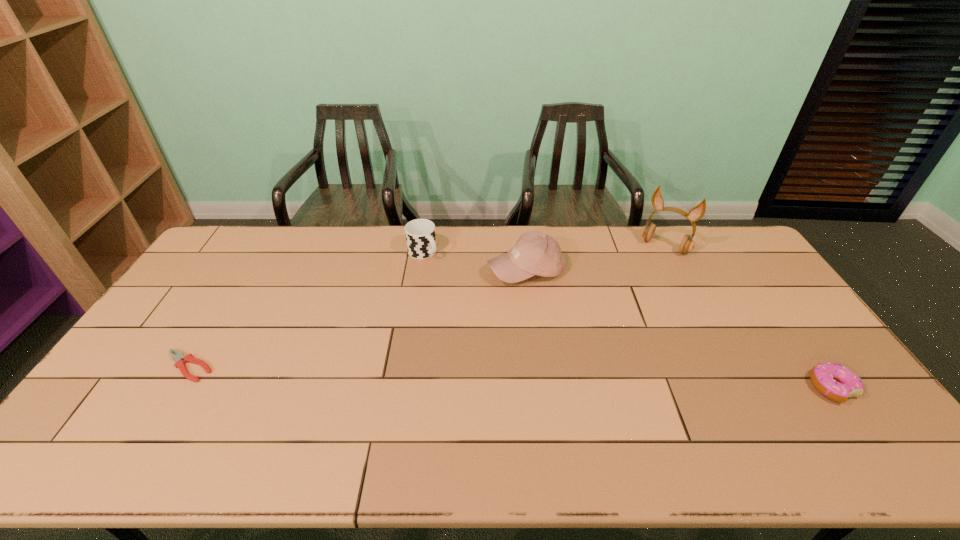
Locate an element on the screen. The height and width of the screenshot is (540, 960). vacant area that lies between the fourth shortest object and the fourth tallest object is located at coordinates (679, 329).

Locate an element on the screen. The width and height of the screenshot is (960, 540). free space between the leftmost object and the rightmost object is located at coordinates (510, 377).

Choose which object is the nearest neighbor to the baseball cap. Please provide its 2D coordinates. Your answer should be formatted as a tuple, i.e. [(x, y)], where the tuple contains the x and y coordinates of a point satisfying the conditions above.

[(420, 234)]

Choose which object is the nearest neighbor to the cup. Please provide its 2D coordinates. Your answer should be formatted as a tuple, i.e. [(x, y)], where the tuple contains the x and y coordinates of a point satisfying the conditions above.

[(535, 253)]

Find the location of `vacant area that satisfies the following two spatial constraints: 1. on the back side of the third object from left to right; 2. on the right side of the leftmost object`. vacant area that satisfies the following two spatial constraints: 1. on the back side of the third object from left to right; 2. on the right side of the leftmost object is located at coordinates (248, 270).

The height and width of the screenshot is (540, 960). In order to click on vacant area in the image that satisfies the following two spatial constraints: 1. on the front side of the rightmost object; 2. on the right side of the second object from left to right in this screenshot , I will do `click(401, 388)`.

The height and width of the screenshot is (540, 960). Identify the location of blank space that satisfies the following two spatial constraints: 1. on the back side of the cup; 2. on the left side of the pliers. (258, 253).